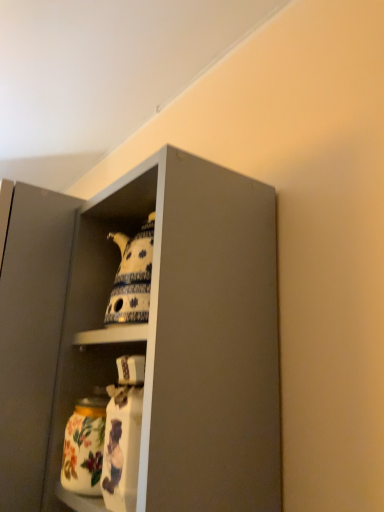
Question: Is porcelain teapot at upper center, which is counted as the 1th cabinet, starting from the right, outside floral ceramic jar at lower left?

Choices:
 (A) yes
 (B) no

Answer: (A)

Question: Can you confirm if porcelain teapot at upper center, which is counted as the 1th cabinet, starting from the right, is bigger than floral ceramic jar at lower left?

Choices:
 (A) no
 (B) yes

Answer: (B)

Question: From a real-world perspective, is porcelain teapot at upper center, which is the 2th cabinet from left to right, physically above floral ceramic jar at lower left?

Choices:
 (A) no
 (B) yes

Answer: (B)

Question: Is porcelain teapot at upper center, which is the 2th cabinet from left to right, facing towards floral ceramic jar at lower left?

Choices:
 (A) yes
 (B) no

Answer: (B)

Question: Can you confirm if porcelain teapot at upper center, which is counted as the 1th cabinet, starting from the right, is wider than floral ceramic jar at lower left?

Choices:
 (A) no
 (B) yes

Answer: (B)

Question: From the image's perspective, relative to porcelain teapot at upper center, placed as the 1th cabinet when sorted from left to right, is matte gray cabinet at upper center above or below?

Choices:
 (A) below
 (B) above

Answer: (B)

Question: In terms of size, does matte gray cabinet at upper center appear bigger or smaller than porcelain teapot at upper center, placed as the 1th cabinet when sorted from left to right?

Choices:
 (A) big
 (B) small

Answer: (B)

Question: From their relative heights in the image, would you say matte gray cabinet at upper center is taller or shorter than porcelain teapot at upper center, which is the second cabinet in right-to-left order?

Choices:
 (A) short
 (B) tall

Answer: (A)

Question: From a real-world perspective, relative to porcelain teapot at upper center, which is the second cabinet in right-to-left order, is matte gray cabinet at upper center vertically above or below?

Choices:
 (A) above
 (B) below

Answer: (A)

Question: Is point (18, 338) closer or farther from the camera than point (137, 199)?

Choices:
 (A) farther
 (B) closer

Answer: (B)

Question: In terms of height, does matte gray cabinet at upper center look taller or shorter compared to porcelain teapot at upper center, which is counted as the 1th cabinet, starting from the right?

Choices:
 (A) short
 (B) tall

Answer: (B)

Question: From the image's perspective, is matte gray cabinet at upper center above or below porcelain teapot at upper center, which is counted as the 1th cabinet, starting from the right?

Choices:
 (A) below
 (B) above

Answer: (A)

Question: Considering the positions of matte gray cabinet at upper center and porcelain teapot at upper center, which is the 2th cabinet from left to right, in the image, is matte gray cabinet at upper center wider or thinner than porcelain teapot at upper center, which is the 2th cabinet from left to right,?

Choices:
 (A) wide
 (B) thin

Answer: (A)

Question: In terms of size, does porcelain teapot at upper center, which is counted as the 1th cabinet, starting from the right, appear bigger or smaller than matte gray cabinet at upper center?

Choices:
 (A) big
 (B) small

Answer: (B)

Question: Visually, is porcelain teapot at upper center, which is counted as the 1th cabinet, starting from the right, positioned to the left or to the right of matte gray cabinet at upper center?

Choices:
 (A) right
 (B) left

Answer: (B)